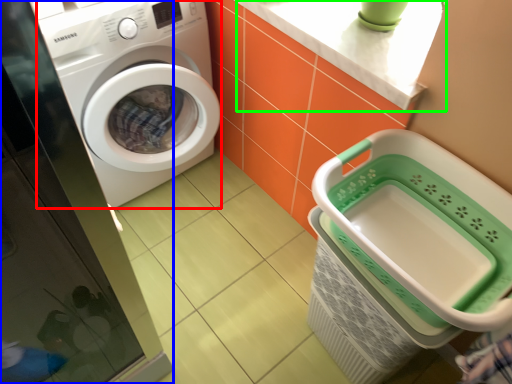
Question: Which object is positioned closest to washing machine (highlighted by a red box)? Select from screen door (highlighted by a blue box) and counter top (highlighted by a green box).

Choices:
 (A) screen door
 (B) counter top

Answer: (A)